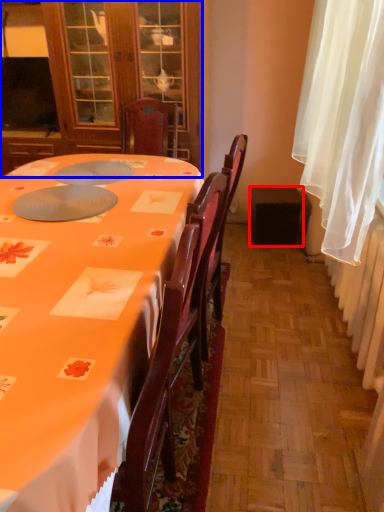
Question: Among these objects, which one is farthest to the camera, loudspeaker (highlighted by a red box) or cabinetry (highlighted by a blue box)?

Choices:
 (A) loudspeaker
 (B) cabinetry

Answer: (A)